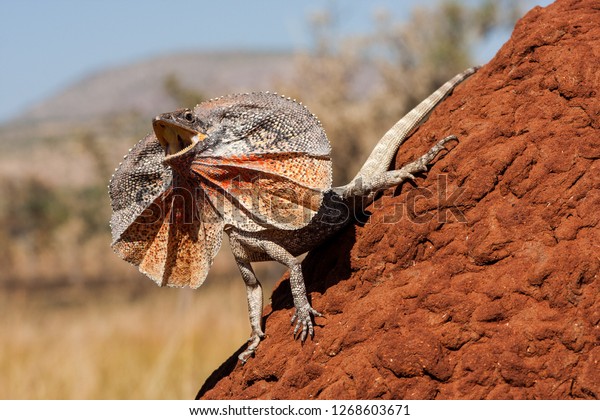
Locate an element on the screen. hood is located at coordinates (283, 137).